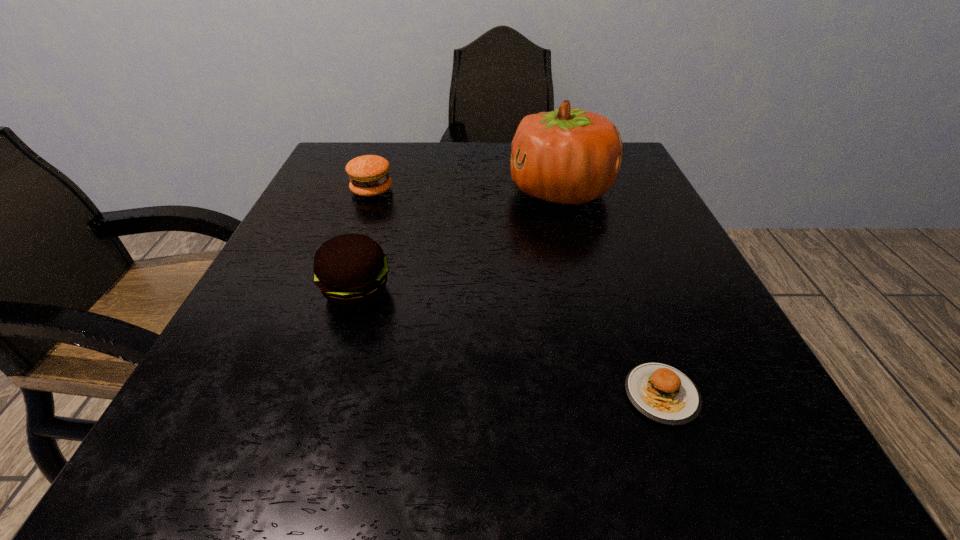
You are a GUI agent. You are given a task and a screenshot of the screen. Output one action in this format:
    pyautogui.click(x=<x>, y=<y>)
    Task: Click on the object positioned at the near right corner
    This screenshot has height=540, width=960.
    Given the screenshot: What is the action you would take?
    pyautogui.click(x=662, y=393)

The image size is (960, 540). In the image, there is a desktop. In order to click on vacant space at the far edge in this screenshot , I will do `click(469, 179)`.

At what (x,y) coordinates should I click in order to perform the action: click on free space at the near edge. Please return your answer as a coordinate pair (x, y). Looking at the image, I should click on (367, 464).

The image size is (960, 540). In the image, there is a desktop. What are the coordinates of `free space at the left edge` in the screenshot? It's located at (349, 214).

At what (x,y) coordinates should I click in order to perform the action: click on vacant space at the right edge of the desktop. Please return your answer as a coordinate pair (x, y). Image resolution: width=960 pixels, height=540 pixels. Looking at the image, I should click on (686, 362).

Identify the location of vacant space at the far left corner of the desktop. (353, 152).

You are a GUI agent. You are given a task and a screenshot of the screen. Output one action in this format:
    pyautogui.click(x=<x>, y=<y>)
    Task: Click on the blank area at the near right corner
    The image size is (960, 540).
    Given the screenshot: What is the action you would take?
    pyautogui.click(x=786, y=447)

This screenshot has height=540, width=960. What are the coordinates of `free space that is in between the shortest object and the pumpkin` in the screenshot? It's located at (611, 293).

You are a GUI agent. You are given a task and a screenshot of the screen. Output one action in this format:
    pyautogui.click(x=<x>, y=<y>)
    Task: Click on the vacant point located between the nearest object and the third tallest object
    The image size is (960, 540).
    Given the screenshot: What is the action you would take?
    point(516,293)

Locate an element on the screen. The width and height of the screenshot is (960, 540). vacant area that lies between the second nearest food and the nearest food is located at coordinates (509, 343).